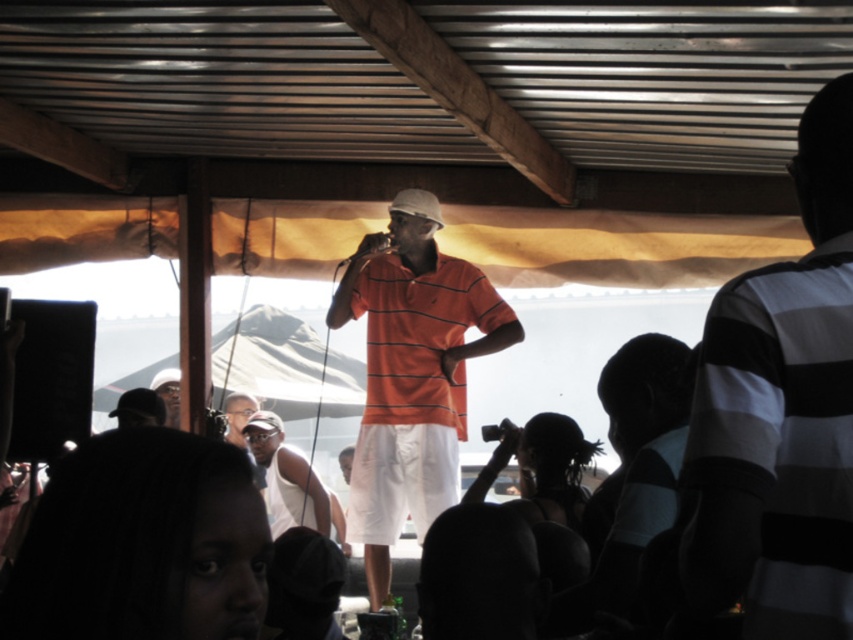
Who is lower down, orange striped shirt at center or matte black cap at upper center?

matte black cap at upper center

Is point (497, 323) farther from viewer compared to point (178, 385)?

No, (497, 323) is in front of (178, 385).

Find the location of a particular element. This screenshot has width=853, height=640. orange striped shirt at center is located at coordinates (412, 372).

How far apart are striped cotton shirt at right and orange striped polo shirt at center?

A distance of 3.24 meters exists between striped cotton shirt at right and orange striped polo shirt at center.

Is striped cotton shirt at right wider than orange striped polo shirt at center?

A: In fact, striped cotton shirt at right might be narrower than orange striped polo shirt at center.

Is point (699, 538) positioned behind point (384, 336)?

No.

This screenshot has height=640, width=853. Identify the location of striped cotton shirt at right. (781, 413).

Is striped cotton shirt at right positioned behind orange striped shirt at center?

No, striped cotton shirt at right is in front of orange striped shirt at center.

Is point (712, 499) positioned before point (432, 390)?

Yes, it is in front of point (432, 390).

Which is behind, point (688, 540) or point (399, 211)?

Point (399, 211)

Where is `striped cotton shirt at right`? striped cotton shirt at right is located at coordinates (781, 413).